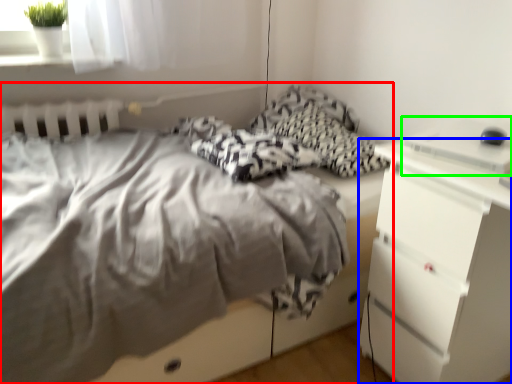
Question: Which is nearer to the bed (highlighted by a red box)? chest of drawers (highlighted by a blue box) or desktop (highlighted by a green box).

Choices:
 (A) chest of drawers
 (B) desktop

Answer: (A)